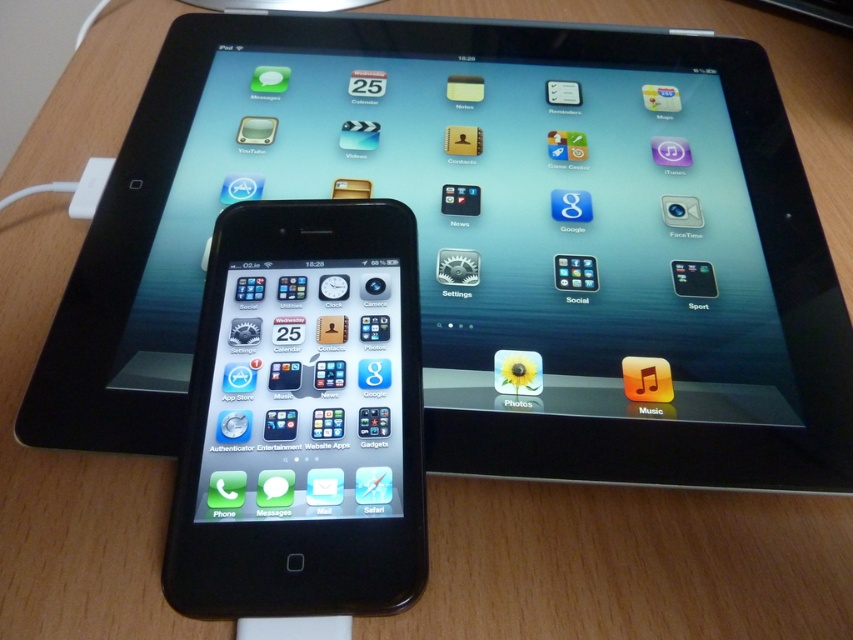
You are trying to decide which device to use for watching a movie. Both the black glossy tablet at upper center and the black glossy tablet at center are available. Based on their sizes, which one would provide a better viewing experience?

The black glossy tablet at upper center has a larger size compared to the black glossy tablet at center, so it would provide a better viewing experience for watching a movie.

You are holding a black glossy tablet at upper center and want to place it on a shelf that can only hold items closer to you than the black glossy tablet at center. Can you place it there?

The black glossy tablet at upper center is further to the viewer than the black glossy tablet at center, so it is too far away to place on the shelf which requires items to be closer than the black glossy tablet at center.

You are organizing a desk and need to place both the black glossy tablet at upper center and the black glossy tablet at center. According to their positions in the image, which tablet should you place on the right side of the desk?

The black glossy tablet at upper center should be placed on the right side of the desk because it is positioned to the right of the black glossy tablet at center in the image.